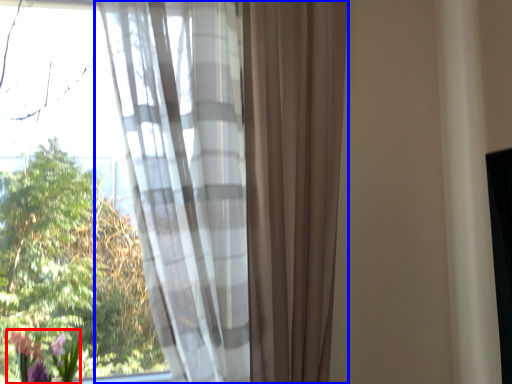
Question: Which object is further to the camera taking this photo, floral arrangement (highlighted by a red box) or curtain (highlighted by a blue box)?

Choices:
 (A) floral arrangement
 (B) curtain

Answer: (A)